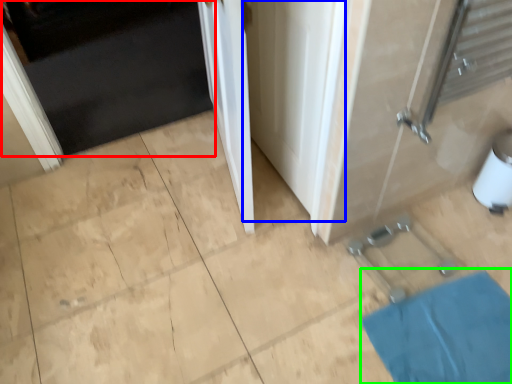
Question: Which object is the closest to the door (highlighted by a red box)? Choose among these: screen door (highlighted by a blue box) or bath mat (highlighted by a green box).

Choices:
 (A) screen door
 (B) bath mat

Answer: (A)